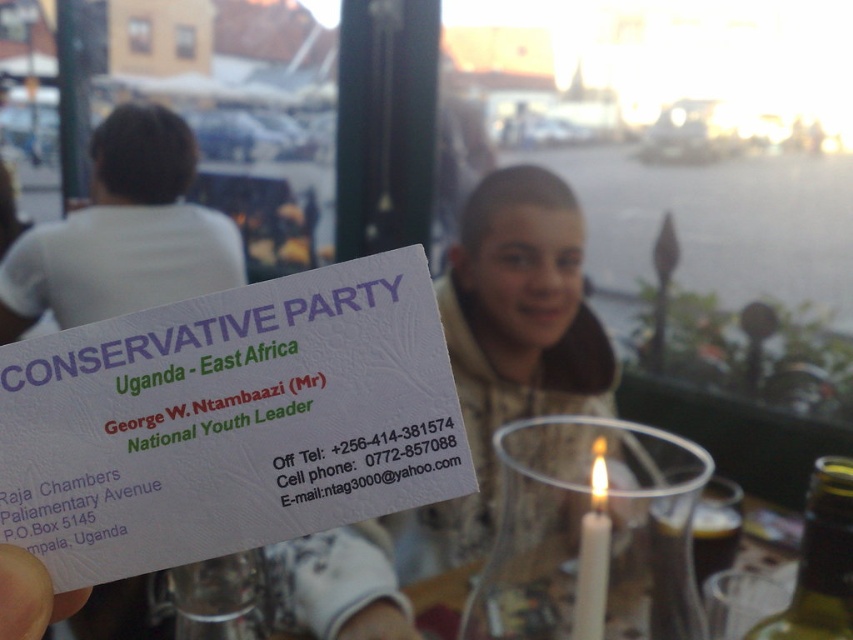
Who is more distant from viewer, (x=71, y=611) or (x=579, y=573)?

Point (x=579, y=573)

Measure the distance between point (6, 572) and camera.

8.86 inches

Where is `white paper business card at lower left`? This screenshot has height=640, width=853. white paper business card at lower left is located at coordinates (30, 596).

Who is taller, white textured business card at center or translucent glass candle at center?

white textured business card at center

Image resolution: width=853 pixels, height=640 pixels. Describe the element at coordinates (229, 420) in the screenshot. I see `white textured business card at center` at that location.

Is point (323, 504) farther from viewer compared to point (473, 566)?

No, (323, 504) is in front of (473, 566).

The height and width of the screenshot is (640, 853). I want to click on white textured business card at center, so click(x=229, y=420).

Who is higher up, white textured business card at center or white wax candle at lower right?

white textured business card at center is above.

Is white textured business card at center wider than white wax candle at lower right?

Correct, the width of white textured business card at center exceeds that of white wax candle at lower right.

Locate an element on the screen. The image size is (853, 640). white textured business card at center is located at coordinates (229, 420).

This screenshot has width=853, height=640. I want to click on white textured business card at center, so click(x=229, y=420).